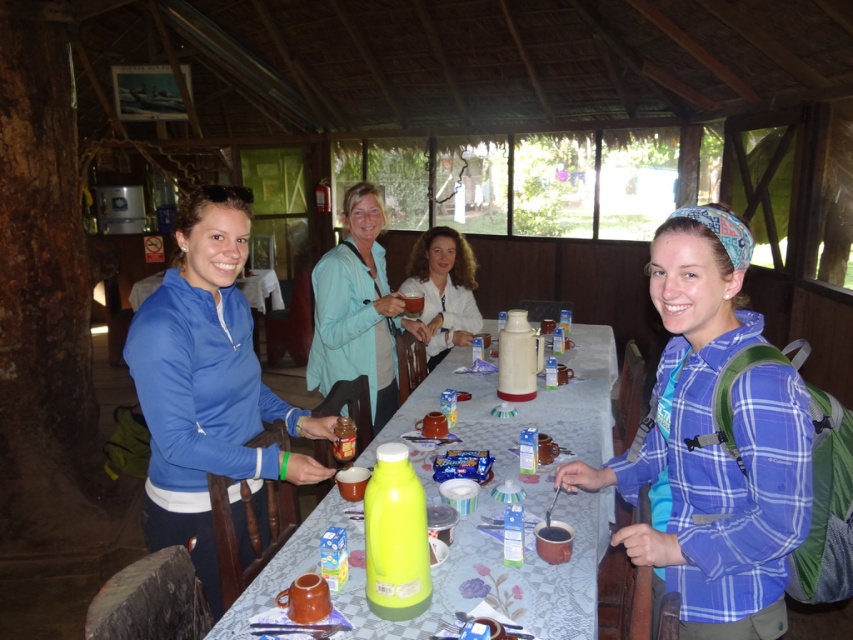
Can you confirm if light blue fabric shirt at center is positioned to the left of white matte shirt at center?

Indeed, light blue fabric shirt at center is positioned on the left side of white matte shirt at center.

Does light blue fabric shirt at center have a lesser height compared to white matte shirt at center?

No, light blue fabric shirt at center is not shorter than white matte shirt at center.

What do you see at coordinates (357, 308) in the screenshot? The height and width of the screenshot is (640, 853). I see `light blue fabric shirt at center` at bounding box center [357, 308].

The width and height of the screenshot is (853, 640). In order to click on light blue fabric shirt at center in this screenshot , I will do `click(357, 308)`.

Does blue plaid shirt at center appear on the right side of translucent plastic bottle at center?

Indeed, blue plaid shirt at center is positioned on the right side of translucent plastic bottle at center.

Can you confirm if blue plaid shirt at center is bigger than translucent plastic bottle at center?

Actually, blue plaid shirt at center might be smaller than translucent plastic bottle at center.

Is point (730, 621) farther from viewer compared to point (590, 564)?

No.

The image size is (853, 640). Find the location of `blue plaid shirt at center`. blue plaid shirt at center is located at coordinates (712, 445).

Is blue plaid shirt at center to the left of matte blue sweatshirt at left from the viewer's perspective?

Incorrect, blue plaid shirt at center is not on the left side of matte blue sweatshirt at left.

Which of these two, blue plaid shirt at center or matte blue sweatshirt at left, stands shorter?

Standing shorter between the two is blue plaid shirt at center.

Is point (695, 564) closer to viewer compared to point (213, 193)?

Yes, point (695, 564) is closer to viewer.

Where is `blue plaid shirt at center`? The height and width of the screenshot is (640, 853). blue plaid shirt at center is located at coordinates (712, 445).